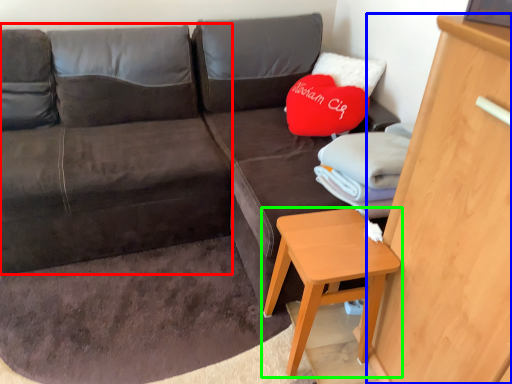
Question: Which is farther away from bean bag chair (highlighted by a red box)? dresser (highlighted by a blue box) or table (highlighted by a green box)?

Choices:
 (A) dresser
 (B) table

Answer: (A)